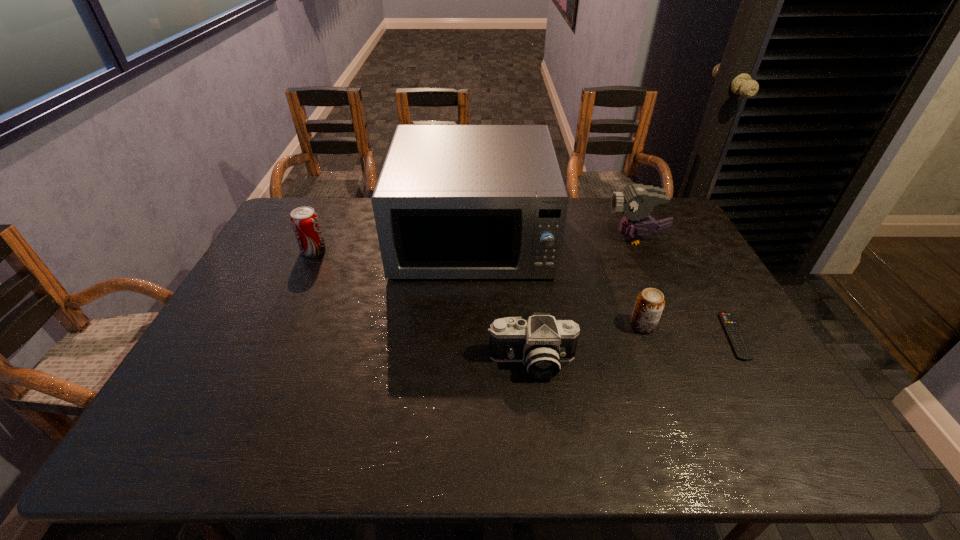
At what (x,y) coordinates should I click in order to perform the action: click on free space between the camera and the remote control. Please return your answer as a coordinate pair (x, y). This screenshot has width=960, height=540. Looking at the image, I should click on (633, 349).

Where is `unoccupied position between the second shortest object and the camera`? The image size is (960, 540). unoccupied position between the second shortest object and the camera is located at coordinates (588, 344).

Locate an element on the screen. free area in between the bird and the second shortest object is located at coordinates (639, 282).

At what (x,y) coordinates should I click in order to perform the action: click on unoccupied position between the camera and the bird. Please return your answer as a coordinate pair (x, y). Looking at the image, I should click on (584, 300).

You are a GUI agent. You are given a task and a screenshot of the screen. Output one action in this format:
    pyautogui.click(x=<x>, y=<y>)
    Task: Click on the empty location between the microwave oven and the shortest object
    The image size is (960, 540).
    Given the screenshot: What is the action you would take?
    pyautogui.click(x=603, y=287)

This screenshot has width=960, height=540. What are the coordinates of `vacant area between the bird and the rightmost object` in the screenshot? It's located at (685, 287).

Identify which object is the fifth nearest to the beer can. Please provide its 2D coordinates. Your answer should be formatted as a tuple, i.e. [(x, y)], where the tuple contains the x and y coordinates of a point satisfying the conditions above.

[(304, 220)]

Identify which object is the closest to the fifth shortest object. Please provide its 2D coordinates. Your answer should be formatted as a tuple, i.e. [(x, y)], where the tuple contains the x and y coordinates of a point satisfying the conditions above.

[(452, 201)]

Locate an element on the screen. free location that satisfies the following two spatial constraints: 1. with the door open on the microwave oven; 2. on the left side of the shortest object is located at coordinates (470, 336).

You are a GUI agent. You are given a task and a screenshot of the screen. Output one action in this format:
    pyautogui.click(x=<x>, y=<y>)
    Task: Click on the free location that satisfies the following two spatial constraints: 1. at the beak of the fifth shortest object; 2. on the right side of the rightmost object
    
    Given the screenshot: What is the action you would take?
    pyautogui.click(x=681, y=336)